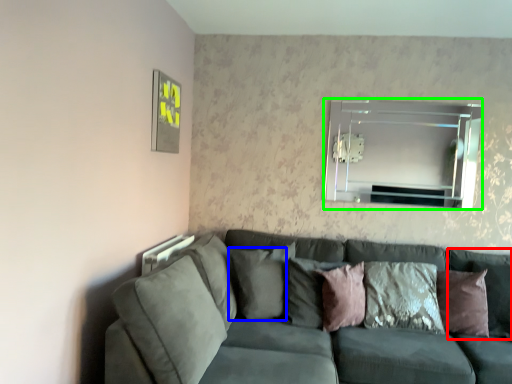
Question: Which object is the closest to the pillow (highlighted by a red box)? Choose among these: pillow (highlighted by a blue box) or mirror (highlighted by a green box).

Choices:
 (A) pillow
 (B) mirror

Answer: (B)